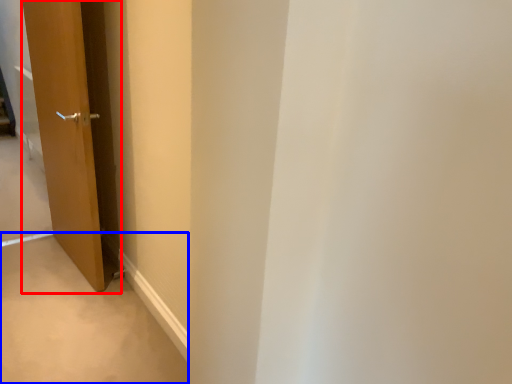
Question: Which point is further to the camera, door (highlighted by a red box) or path (highlighted by a blue box)?

Choices:
 (A) door
 (B) path

Answer: (A)